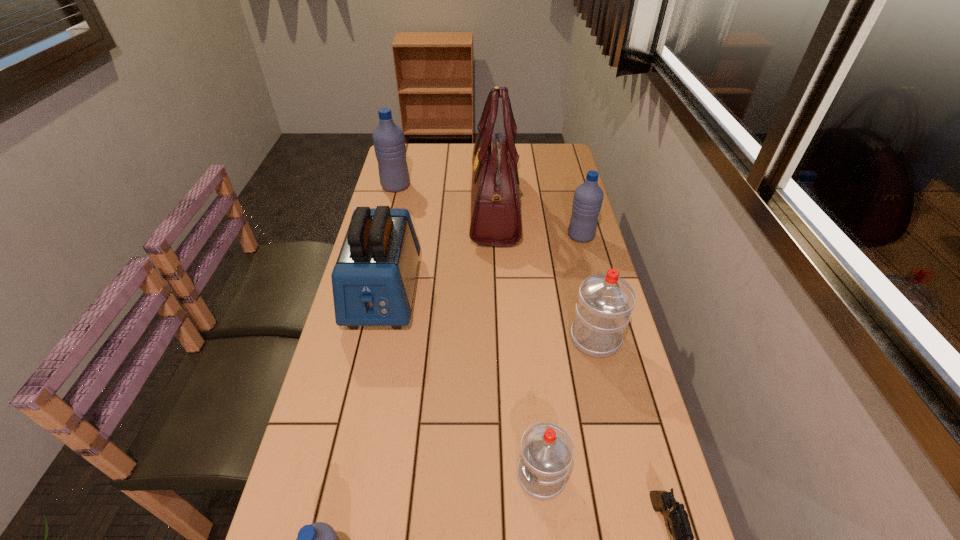
Locate an element on the screen. This screenshot has height=540, width=960. vacant area that lies between the second nearest blue water bottle and the tallest object is located at coordinates (538, 222).

At what (x,y) coordinates should I click in order to perform the action: click on vacant space that's between the toaster and the third nearest water bottle. Please return your answer as a coordinate pair (x, y). Looking at the image, I should click on (490, 315).

This screenshot has width=960, height=540. I want to click on vacant space in between the second nearest blue water bottle and the tallest object, so click(x=538, y=222).

Where is `the fifth closest object to the gun`? The width and height of the screenshot is (960, 540). the fifth closest object to the gun is located at coordinates (588, 197).

Select which object is the second closest to the smallest blue water bottle. Please provide its 2D coordinates. Your answer should be formatted as a tuple, i.e. [(x, y)], where the tuple contains the x and y coordinates of a point satisfying the conditions above.

[(373, 280)]

Image resolution: width=960 pixels, height=540 pixels. Identify the location of water bottle that is the third closest one to the nearer white water bottle. (588, 197).

The height and width of the screenshot is (540, 960). I want to click on water bottle that is the third closest to the second nearest blue water bottle, so click(547, 450).

Select which blue water bottle appears as the closest to the biggest blue water bottle. Please provide its 2D coordinates. Your answer should be formatted as a tuple, i.e. [(x, y)], where the tuple contains the x and y coordinates of a point satisfying the conditions above.

[(588, 197)]

Locate which blue water bottle ranks third in proximity to the right white water bottle. Please provide its 2D coordinates. Your answer should be formatted as a tuple, i.e. [(x, y)], where the tuple contains the x and y coordinates of a point satisfying the conditions above.

[(388, 139)]

Where is `vacant position in the image that satisfies the following two spatial constraints: 1. on the front-facing side of the handbag; 2. on the handle side of the bigger white water bottle`? vacant position in the image that satisfies the following two spatial constraints: 1. on the front-facing side of the handbag; 2. on the handle side of the bigger white water bottle is located at coordinates (500, 338).